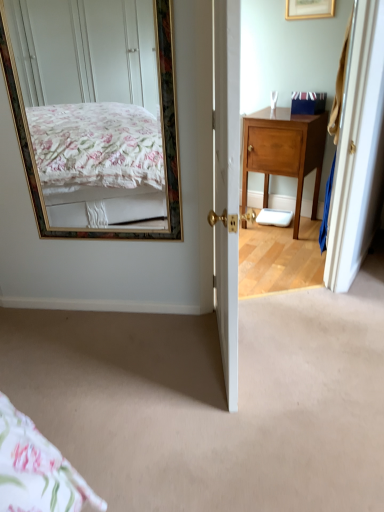
Question: From a real-world perspective, is wooden cabinet at right positioned above or below carpet at center?

Choices:
 (A) above
 (B) below

Answer: (A)

Question: Would you say wooden cabinet at right is inside or outside carpet at center?

Choices:
 (A) outside
 (B) inside

Answer: (A)

Question: Considering the real-world distances, which object is farthest from the wooden cabinet at right?

Choices:
 (A) blue cardboard box at upper right
 (B) gold-framed mirror at upper left
 (C) carpet at center

Answer: (C)

Question: Which is farther from the wooden cabinet at right?

Choices:
 (A) carpet at center
 (B) gold-framed mirror at upper left
 (C) blue cardboard box at upper right

Answer: (A)